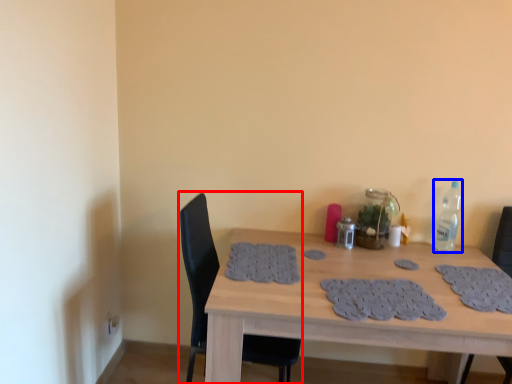
Question: Which of the following is the closest to the observer, chair (highlighted by a red box) or bottle (highlighted by a blue box)?

Choices:
 (A) chair
 (B) bottle

Answer: (A)